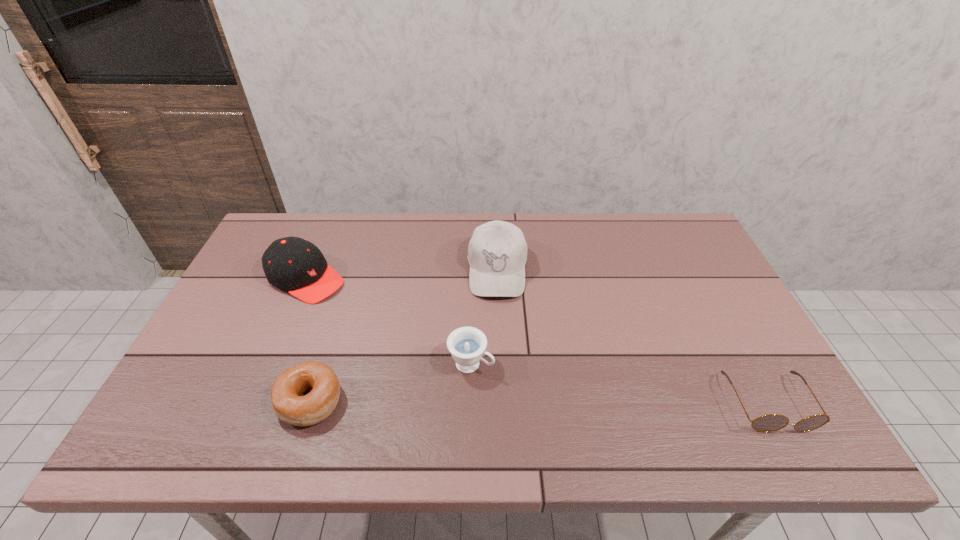
Locate an element on the screen. vacant space at the near right corner is located at coordinates (739, 395).

Identify the location of vacant space that is in between the rightmost object and the second tallest object. The image size is (960, 540). [537, 341].

Locate an element on the screen. This screenshot has width=960, height=540. vacant space that is in between the rightmost object and the second tallest object is located at coordinates (537, 341).

Where is `free spot between the third shortest object and the cap`? free spot between the third shortest object and the cap is located at coordinates (389, 321).

Image resolution: width=960 pixels, height=540 pixels. In order to click on unoccupied position between the teacup and the sunglasses in this screenshot , I will do `click(619, 383)`.

The height and width of the screenshot is (540, 960). I want to click on vacant area that lies between the bagel and the rightmost object, so click(539, 402).

Identify the location of free space between the rightmost object and the baseball cap. (633, 336).

In order to click on vacant area that lies between the baseball cap and the rightmost object in this screenshot , I will do `click(633, 336)`.

Locate an element on the screen. The width and height of the screenshot is (960, 540). vacant space that is in between the baseball cap and the bagel is located at coordinates (403, 335).

Where is `free space between the baseball cap and the bagel`? free space between the baseball cap and the bagel is located at coordinates (403, 335).